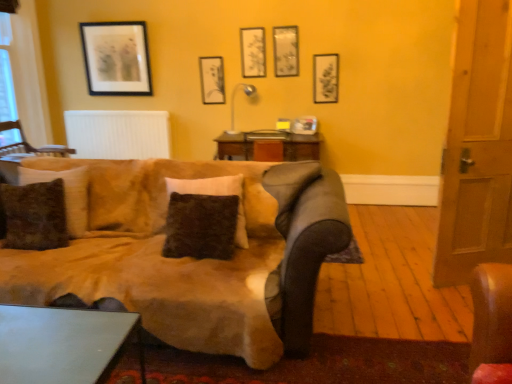
Question: Is wooden chair at left inside metallic gray table at lower left?

Choices:
 (A) no
 (B) yes

Answer: (A)

Question: From the image's perspective, would you say metallic gray table at lower left is shown under wooden chair at left?

Choices:
 (A) yes
 (B) no

Answer: (A)

Question: Is metallic gray table at lower left oriented away from wooden chair at left?

Choices:
 (A) no
 (B) yes

Answer: (A)

Question: Does metallic gray table at lower left have a lesser width compared to wooden chair at left?

Choices:
 (A) no
 (B) yes

Answer: (B)

Question: Are metallic gray table at lower left and wooden chair at left beside each other?

Choices:
 (A) yes
 (B) no

Answer: (B)

Question: Can we say metallic gray table at lower left lies outside wooden chair at left?

Choices:
 (A) no
 (B) yes

Answer: (B)

Question: Considering the relative sizes of matte black picture frame at upper center, the 3th picture frame viewed from the right, and white matte radiator at upper center in the image provided, is matte black picture frame at upper center, the 3th picture frame viewed from the right, shorter than white matte radiator at upper center?

Choices:
 (A) yes
 (B) no

Answer: (A)

Question: Is matte black picture frame at upper center, acting as the 3th picture frame starting from the left, located outside white matte radiator at upper center?

Choices:
 (A) no
 (B) yes

Answer: (B)

Question: Is matte black picture frame at upper center, the 3th picture frame viewed from the right, aimed at white matte radiator at upper center?

Choices:
 (A) yes
 (B) no

Answer: (B)

Question: Is matte black picture frame at upper center, acting as the 3th picture frame starting from the left, oriented away from white matte radiator at upper center?

Choices:
 (A) yes
 (B) no

Answer: (B)

Question: Is matte black picture frame at upper center, acting as the 3th picture frame starting from the left, behind white matte radiator at upper center?

Choices:
 (A) no
 (B) yes

Answer: (A)

Question: Is matte black picture frame at upper center, acting as the 3th picture frame starting from the left, taller than white matte radiator at upper center?

Choices:
 (A) yes
 (B) no

Answer: (B)

Question: Does matte black picture frame at upper center, acting as the 3th picture frame starting from the left, appear on the left side of matte black picture frame at upper center, marked as the 4th picture frame in a right-to-left arrangement?

Choices:
 (A) yes
 (B) no

Answer: (B)